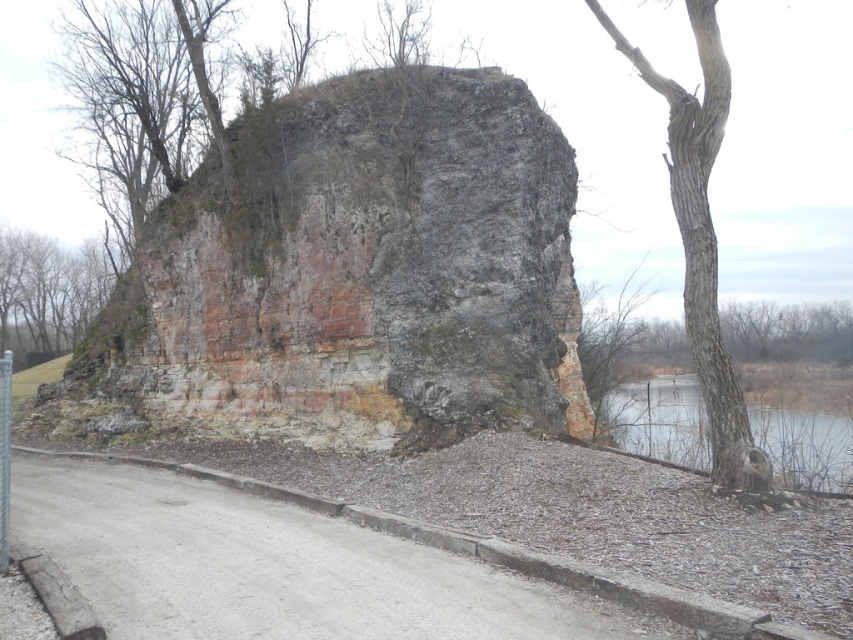
Question: Does brown rough tree at left have a greater width compared to bare branches at right?

Choices:
 (A) no
 (B) yes

Answer: (B)

Question: Can you confirm if rusty stone cliff at center is positioned to the left of brown rough tree at left?

Choices:
 (A) yes
 (B) no

Answer: (B)

Question: Which object is the farthest from the smooth gray bark tree at right?

Choices:
 (A) bare branches at right
 (B) rusty stone cliff at center

Answer: (A)

Question: Which point appears closest to the camera in this image?

Choices:
 (A) (482, 300)
 (B) (61, 296)
 (C) (682, 140)
 (D) (602, 390)

Answer: (C)

Question: Is the position of rusty stone cliff at center more distant than that of bare branches at right?

Choices:
 (A) yes
 (B) no

Answer: (B)

Question: Considering the real-world distances, which object is farthest from the brown rough tree at left?

Choices:
 (A) smooth gray bark tree at right
 (B) bare branches at right
 (C) rusty stone cliff at center

Answer: (A)